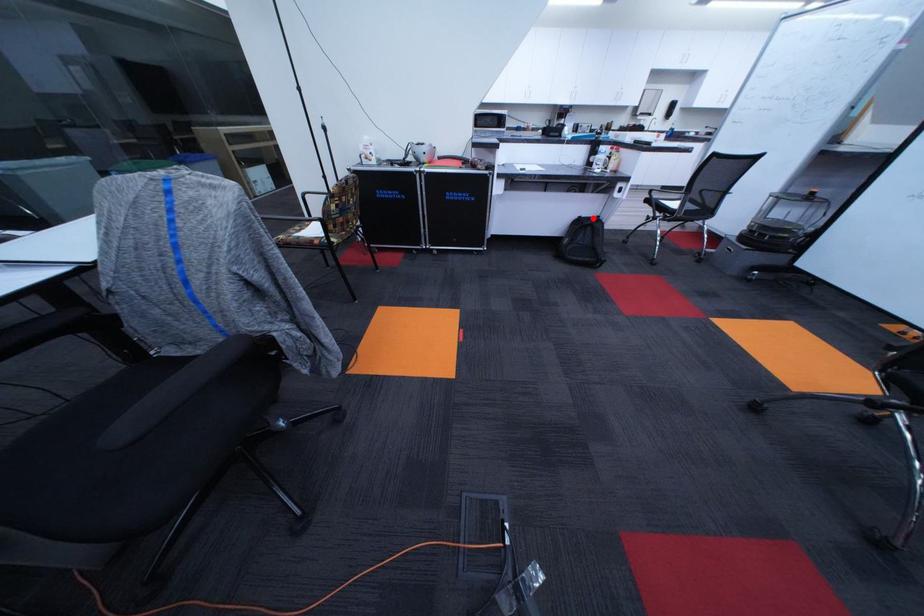
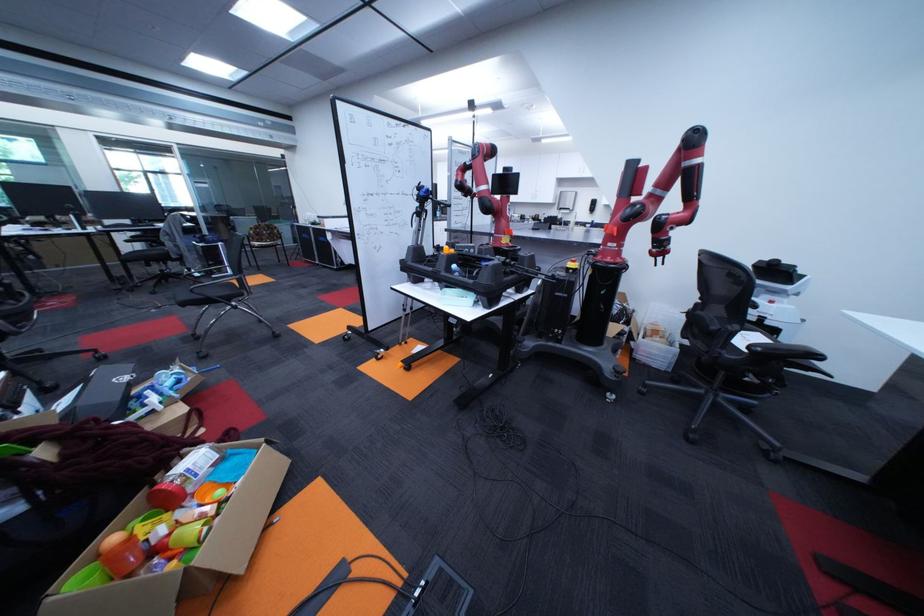
Question: I am providing you with two images of the same scene from different viewpoints. A red point is marked on the first image. Is the red point's position out of view in image 2?

Choices:
 (A) Yes
 (B) No

Answer: (A)